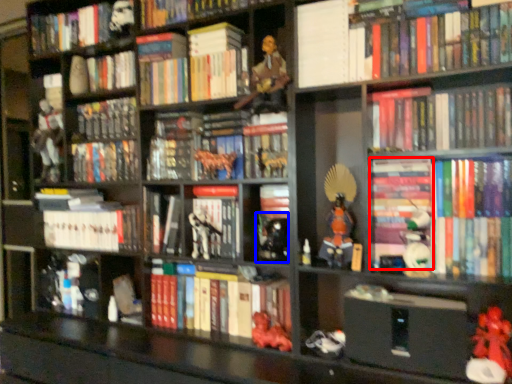
Question: Which object appears farthest to the camera in this image, book (highlighted by a red box) or toy (highlighted by a blue box)?

Choices:
 (A) book
 (B) toy

Answer: (B)